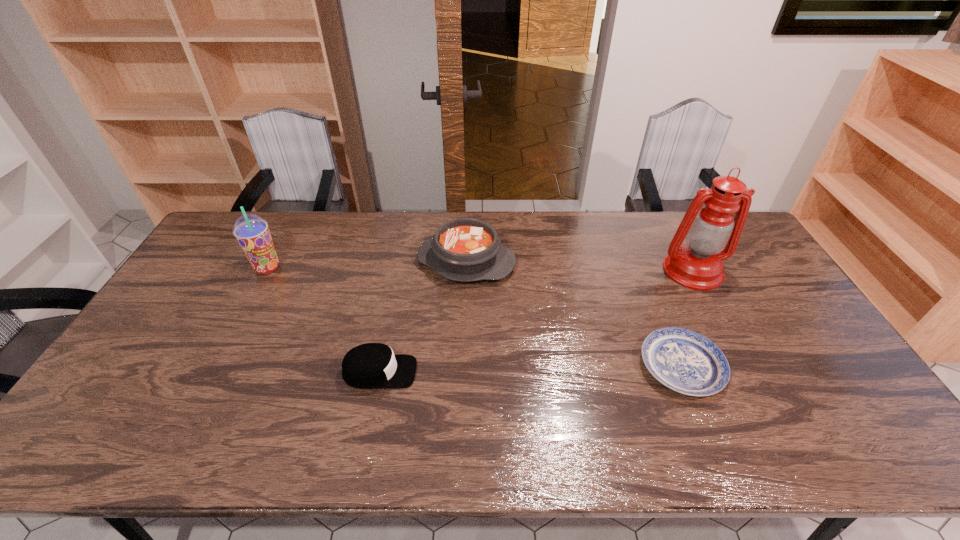
Find the location of a particular element. vacant space in between the tallest object and the fourth tallest object is located at coordinates (537, 321).

This screenshot has height=540, width=960. I want to click on empty space that is in between the fourth tallest object and the second tallest object, so click(324, 320).

You are a GUI agent. You are given a task and a screenshot of the screen. Output one action in this format:
    pyautogui.click(x=<x>, y=<y>)
    Task: Click on the free space between the smoothie and the shortest object
    Image resolution: width=960 pixels, height=540 pixels.
    Given the screenshot: What is the action you would take?
    pyautogui.click(x=474, y=317)

What are the coordinates of `vacant area between the oil lamp and the third tallest object` in the screenshot? It's located at (580, 266).

I want to click on free spot between the third shortest object and the fourth tallest object, so click(x=423, y=317).

The width and height of the screenshot is (960, 540). I want to click on vacant point located between the plate and the leftmost object, so click(x=474, y=317).

Point out which object is positioned as the nearest to the shortest object. Please provide its 2D coordinates. Your answer should be formatted as a tuple, i.e. [(x, y)], where the tuple contains the x and y coordinates of a point satisfying the conditions above.

[(712, 235)]

Identify which object is the closest to the second shortest object. Please provide its 2D coordinates. Your answer should be formatted as a tuple, i.e. [(x, y)], where the tuple contains the x and y coordinates of a point satisfying the conditions above.

[(465, 249)]

Find the location of a particular element. free space that satisfies the following two spatial constraints: 1. on the front side of the casserole; 2. on the front-facing side of the cap is located at coordinates (463, 372).